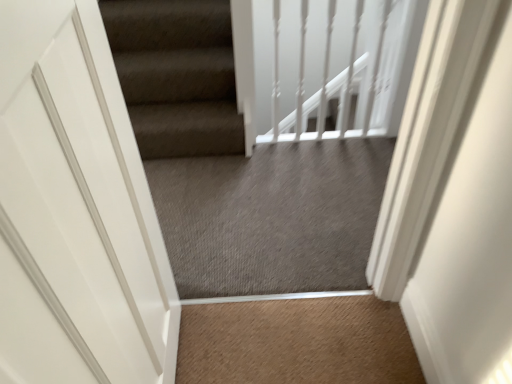
I want to click on white matte door at left, so click(x=75, y=211).

Locate an element on the screen. gray carpet at center is located at coordinates (237, 165).

Image resolution: width=512 pixels, height=384 pixels. Find the location of `white matte door at left`. white matte door at left is located at coordinates (75, 211).

Is white matte door at left beside gray carpet at center?

No, white matte door at left is not touching gray carpet at center.

From a real-world perspective, between white matte door at left and gray carpet at center, who is vertically higher?

In real-world perspective, white matte door at left is above.

Can you confirm if white matte door at left is taller than gray carpet at center?

Correct, white matte door at left is much taller as gray carpet at center.

Is white glossy balustrade at upper center turned away from white matte door at left?

No, white glossy balustrade at upper center is not facing away from white matte door at left.

Based on the photo, who is taller, white glossy balustrade at upper center or white matte door at left?

Standing taller between the two is white matte door at left.

From a real-world perspective, is white glossy balustrade at upper center positioned under white matte door at left based on gravity?

Correct, in the physical world, white glossy balustrade at upper center is lower than white matte door at left.

Is white glossy balustrade at upper center closer to camera compared to white matte door at left?

No, it is not.

From the image's perspective, would you say gray carpet at center is shown under white glossy balustrade at upper center?

Indeed, from the image's perspective, gray carpet at center is shown beneath white glossy balustrade at upper center.

Which is more to the right, gray carpet at center or white glossy balustrade at upper center?

Positioned to the right is white glossy balustrade at upper center.

From the picture: Is gray carpet at center inside or outside of white glossy balustrade at upper center?

gray carpet at center is spatially situated outside white glossy balustrade at upper center.

Measure the distance from gray carpet at center to white glossy balustrade at upper center.

A distance of 19.31 inches exists between gray carpet at center and white glossy balustrade at upper center.

Are gray carpet at center and white matte door at left far apart?

Absolutely, gray carpet at center is distant from white matte door at left.

Considering their positions, is gray carpet at center located in front of or behind white matte door at left?

gray carpet at center is positioned farther from the viewer than white matte door at left.

Can you tell me how much gray carpet at center and white matte door at left differ in facing direction?

2.07 degrees separate the facing orientations of gray carpet at center and white matte door at left.

Is point (192, 192) positioned before point (48, 202)?

That is False.

Is gray carpet at center surrounded by white glossy balustrade at upper center?

Actually, gray carpet at center is outside white glossy balustrade at upper center.

From a real-world perspective, which is physically above, white glossy balustrade at upper center or gray carpet at center?

gray carpet at center is physically above.

From the image's perspective, is white glossy balustrade at upper center located above or below gray carpet at center?

white glossy balustrade at upper center is situated higher than gray carpet at center in the image.

Which is behind, point (60, 5) or point (405, 19)?

The point (405, 19) is behind.

Does white matte door at left have a smaller size compared to white glossy balustrade at upper center?

Incorrect, white matte door at left is not smaller in size than white glossy balustrade at upper center.

Considering the positions of objects white matte door at left and white glossy balustrade at upper center in the image provided, who is more to the left, white matte door at left or white glossy balustrade at upper center?

white matte door at left.

From the image's perspective, is white matte door at left below white glossy balustrade at upper center?

Indeed, from the image's perspective, white matte door at left is shown beneath white glossy balustrade at upper center.

The width and height of the screenshot is (512, 384). Identify the location of escalator below the white matte door at left (from a real-world perspective). click(237, 165).

Find the location of `door in front of the white glossy balustrade at upper center`. door in front of the white glossy balustrade at upper center is located at coordinates pyautogui.click(x=75, y=211).

Considering their positions, is white matte door at left positioned closer to white glossy balustrade at upper center than gray carpet at center?

gray carpet at center is positioned closer to the anchor white glossy balustrade at upper center.

From the image, which object appears to be farther from gray carpet at center, white matte door at left or white glossy balustrade at upper center?

Among the two, white matte door at left is located further to gray carpet at center.

Estimate the real-world distances between objects in this image. Which object is further from white matte door at left, gray carpet at center or white glossy balustrade at upper center?

The object further to white matte door at left is white glossy balustrade at upper center.

Which object lies nearer to the anchor point gray carpet at center, white glossy balustrade at upper center or white matte door at left?

white glossy balustrade at upper center is positioned closer to the anchor gray carpet at center.

Looking at this image, looking at the image, which one is located further to white glossy balustrade at upper center, gray carpet at center or white matte door at left?

white matte door at left is further to white glossy balustrade at upper center.

Considering their positions, is white glossy balustrade at upper center positioned closer to white matte door at left than gray carpet at center?

gray carpet at center lies closer to white matte door at left than the other object.

You are a GUI agent. You are given a task and a screenshot of the screen. Output one action in this format:
    pyautogui.click(x=<x>, y=<y>)
    Task: Click on the escalator between white matte door at left and white glossy balustrade at upper center in the front-back direction
    
    Given the screenshot: What is the action you would take?
    pyautogui.click(x=237, y=165)